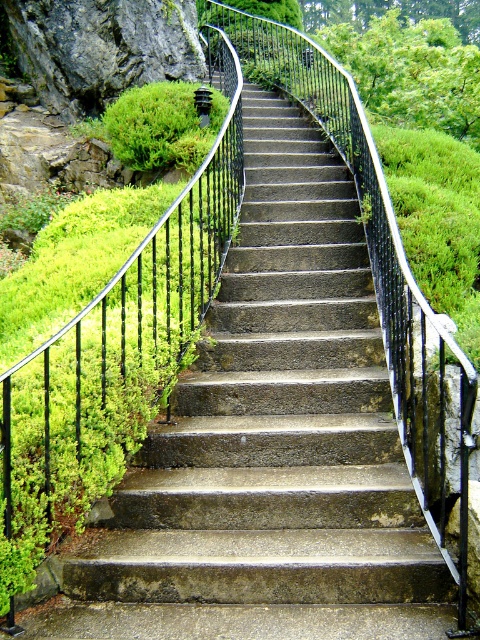
You are standing at the bottom of the concrete stairs at center and want to reach the green mossy rock at upper left. Which direction should you move to get closer to the rock?

You should move to the left because the concrete stairs at center are to the right of the green mossy rock at upper left, so moving left would bring you closer to the rock.

In the scene shown: You are standing at the bottom of the stairs and want to reach the top. Since the concrete stairs at center are at point 0.656, 0.575, can you walk straight ahead to reach them?

Yes, since the concrete stairs at center are located at point (x=276, y=419), walking straight ahead will lead you directly to them.